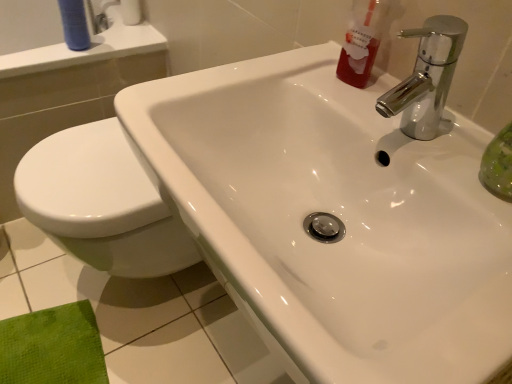
Where is `vacant space in between chrome metallic faucet at upper right and translucent red liquid at upper right`? The height and width of the screenshot is (384, 512). vacant space in between chrome metallic faucet at upper right and translucent red liquid at upper right is located at coordinates (366, 111).